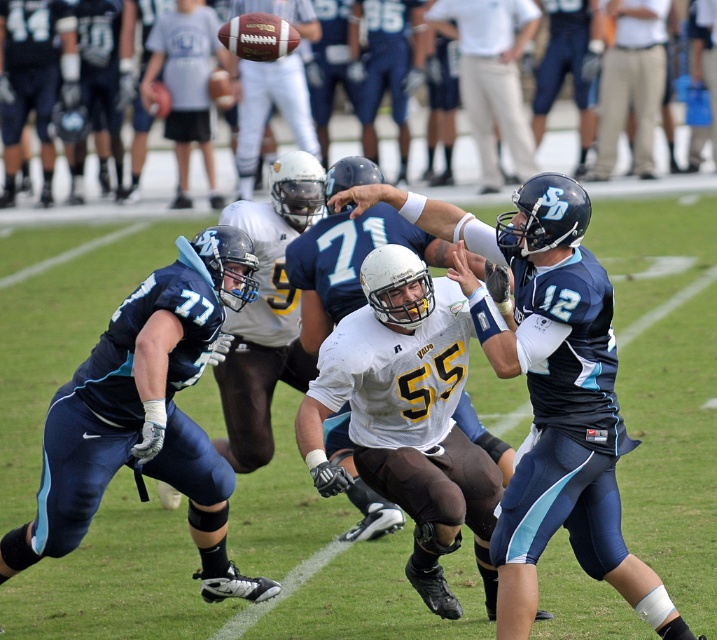
Question: Is white matte jersey at center wider than matte blue uniform at center?

Choices:
 (A) no
 (B) yes

Answer: (B)

Question: Does khaki pants at upper right have a lesser width compared to matte white helmet at center?

Choices:
 (A) no
 (B) yes

Answer: (B)

Question: Considering the real-world distances, which object is farthest from the matte gray helmet at upper center?

Choices:
 (A) khaki pants at upper right
 (B) dark blue uniform at left
 (C) matte blue uniform at center
 (D) light blue jersey at center

Answer: (C)

Question: Considering the real-world distances, which object is closest to the khaki pants at upper right?

Choices:
 (A) matte gray helmet at upper center
 (B) matte white helmet at center
 (C) matte blue uniform at center
 (D) white matte jersey at center

Answer: (B)

Question: Which point is farther to the camera?

Choices:
 (A) dark blue uniform at left
 (B) white matte jersey at center

Answer: (A)

Question: Does matte blue uniform at center have a larger size compared to dark blue uniform at left?

Choices:
 (A) no
 (B) yes

Answer: (B)